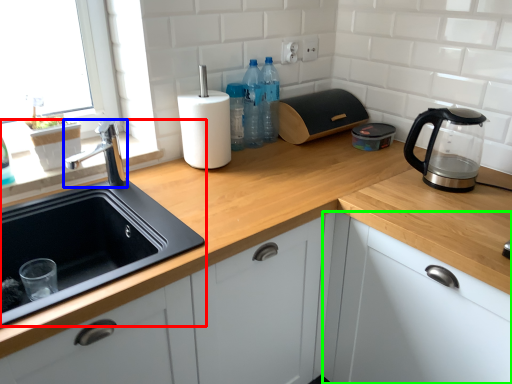
Question: Estimate the real-world distances between objects in this image. Which object is closer to sink (highlighted by a red box), tap (highlighted by a blue box) or cabinetry (highlighted by a green box)?

Choices:
 (A) tap
 (B) cabinetry

Answer: (A)